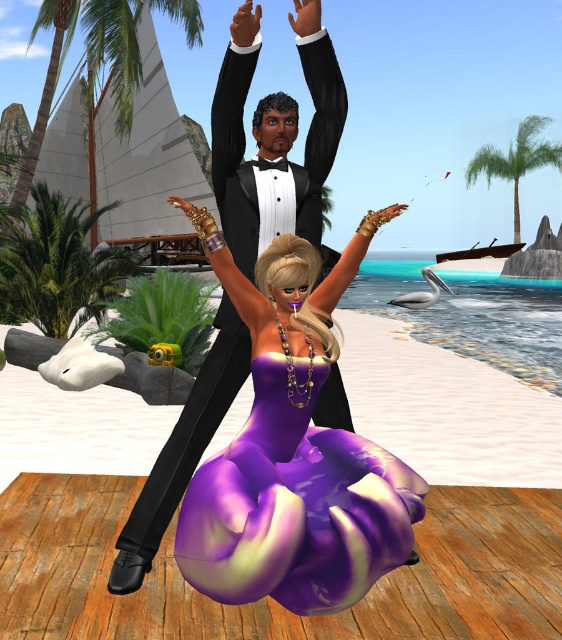
How much distance is there between black satin tuxedo at center and green leafy palm tree at left?

black satin tuxedo at center and green leafy palm tree at left are 9.04 meters apart.

Where is `black satin tuxedo at center`? This screenshot has height=640, width=562. black satin tuxedo at center is located at coordinates pyautogui.click(x=274, y=140).

Consider the image. Who is taller, black satin tuxedo at center or green leafy palm tree at upper right?

Standing taller between the two is green leafy palm tree at upper right.

Who is shorter, black satin tuxedo at center or green leafy palm tree at upper right?

black satin tuxedo at center is shorter.

Which is behind, point (133, 513) or point (474, 160)?

The point (474, 160) is more distant.

Identify the location of black satin tuxedo at center. The width and height of the screenshot is (562, 640). (274, 140).

Is green leafy palm tree at upper left taller than green leafy palm tree at upper right?

Correct, green leafy palm tree at upper left is much taller as green leafy palm tree at upper right.

At what (x,y) coordinates should I click in order to perform the action: click on green leafy palm tree at upper left. Please return your answer as a coordinate pair (x, y). Looking at the image, I should click on (97, 58).

At what (x,y) coordinates should I click in order to perform the action: click on green leafy palm tree at upper left. Please return your answer as a coordinate pair (x, y). The image size is (562, 640). Looking at the image, I should click on (97, 58).